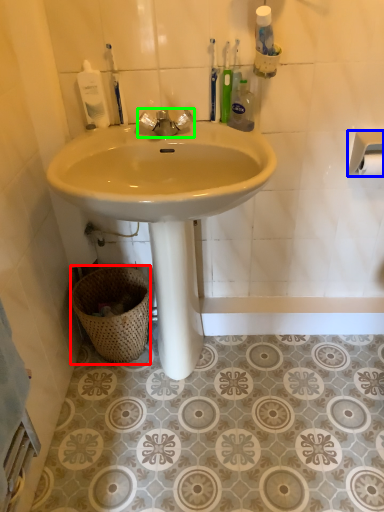
Question: Estimate the real-world distances between objects in this image. Which object is closer to basket (highlighted by a red box), towel bar (highlighted by a blue box) or tap (highlighted by a green box)?

Choices:
 (A) towel bar
 (B) tap

Answer: (B)